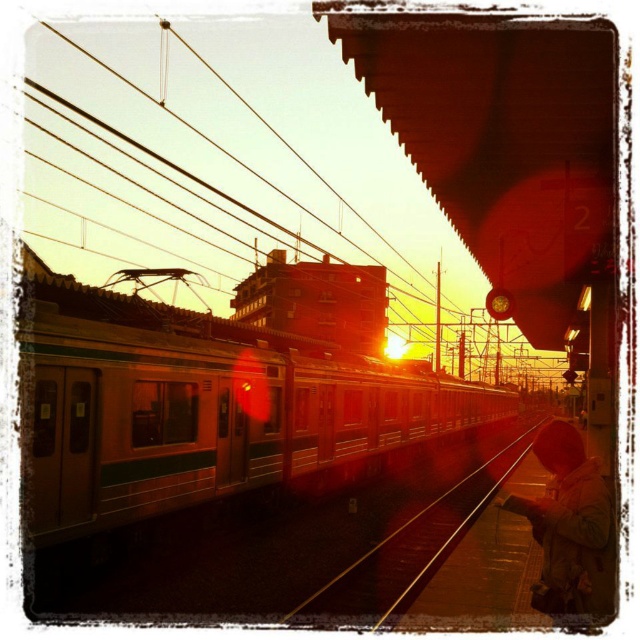
Does metallic wire at upper center appear on the left side of brown woolen coat at lower right?

Yes, metallic wire at upper center is to the left of brown woolen coat at lower right.

Which is above, metallic wire at upper center or brown woolen coat at lower right?

metallic wire at upper center is higher up.

Is point (172, 45) positioned in front of point (595, 518)?

No, (172, 45) is behind (595, 518).

Locate an element on the screen. The width and height of the screenshot is (640, 640). metallic wire at upper center is located at coordinates (262, 172).

Looking at this image, is green metallic train at center wider than metal train track at center?

Correct, the width of green metallic train at center exceeds that of metal train track at center.

Is green metallic train at center below metal train track at center?

No.

Identify the location of green metallic train at center. The height and width of the screenshot is (640, 640). (205, 408).

I want to click on green metallic train at center, so click(x=205, y=408).

Does metallic wire at upper center appear on the left side of green metallic train at center?

Yes, metallic wire at upper center is to the left of green metallic train at center.

Image resolution: width=640 pixels, height=640 pixels. Describe the element at coordinates (262, 172) in the screenshot. I see `metallic wire at upper center` at that location.

Where is `metallic wire at upper center`? The height and width of the screenshot is (640, 640). metallic wire at upper center is located at coordinates (262, 172).